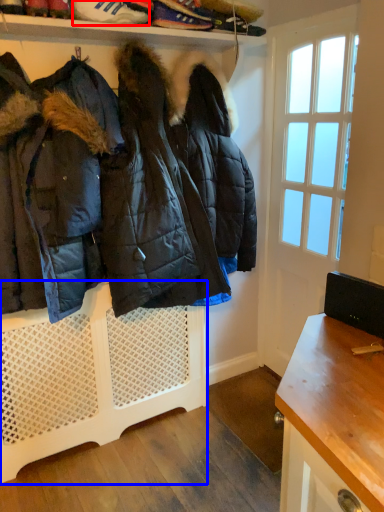
Question: Which point is closer to the camera, footwear (highlighted by a red box) or shelf (highlighted by a blue box)?

Choices:
 (A) footwear
 (B) shelf

Answer: (A)